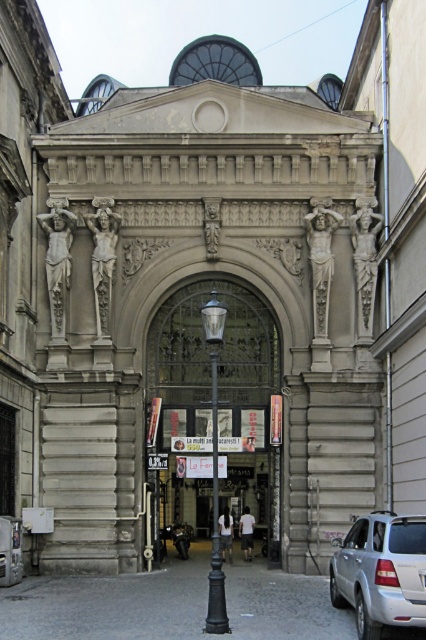
You are standing at the entrance of the historical building and want to determine the relative positions of two points marked in the scene. Which point is closer to you, point 1 at coordinates point 1 at coordinates point (422, 579) or point 2 at coordinates point (213, 234)?

Point 1 at coordinates point (422, 579) is closer to the viewer than point 2 at coordinates point (213, 234).

You are standing in front of the ornate architectural entrance. You see a silver metallic car at center. Can you safely walk towards the entrance without the car blocking your path?

The silver metallic car at center is 81.94 feet away from you, so there is sufficient space to walk towards the entrance without the car blocking your path.

You are a delivery person with a cart that is 10 feet wide. You need to navigate through the entrance shown in the image. There is a polished brass streetlamp at center and a polished stone statue at right. Can your cart fit between them?

The distance between the polished brass streetlamp at center and the polished stone statue at right is 66.23 feet, which is significantly wider than your 10 feet wide cart. Therefore, your cart can easily fit between them.